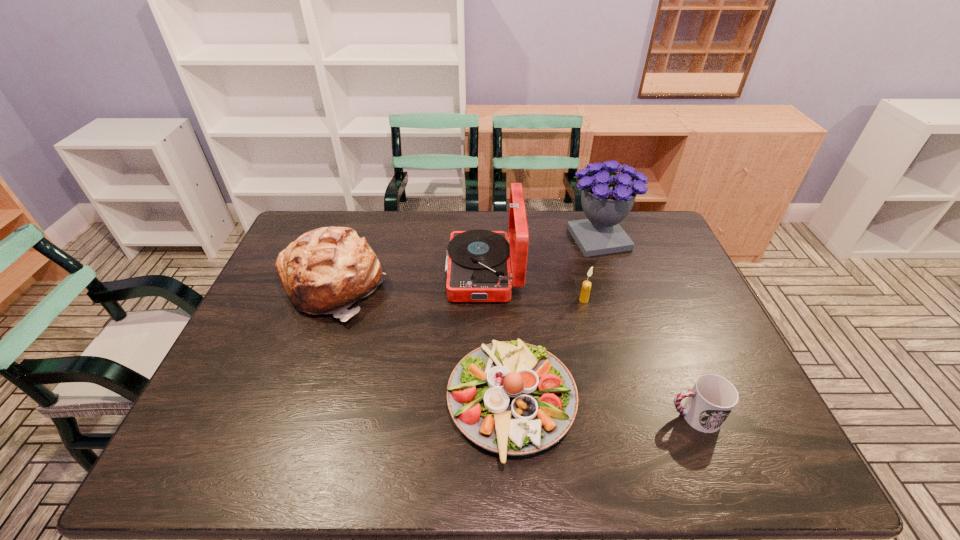
The image size is (960, 540). What are the coordinates of `bouquet` in the screenshot? It's located at (607, 198).

Locate an element on the screen. The width and height of the screenshot is (960, 540). phonograph_record is located at coordinates (478, 269).

Locate an element on the screen. This screenshot has height=540, width=960. the leftmost object is located at coordinates (x=326, y=270).

Where is `bread`? Image resolution: width=960 pixels, height=540 pixels. bread is located at coordinates (326, 270).

At what (x,y) coordinates should I click in order to perform the action: click on the third shortest object. Please return your answer as a coordinate pair (x, y). Looking at the image, I should click on (586, 286).

Find the location of a particular element. The width and height of the screenshot is (960, 540). cup is located at coordinates (711, 400).

At what (x,y) coordinates should I click in order to perform the action: click on salad plate. Please return your answer as a coordinate pair (x, y). Looking at the image, I should click on (512, 398).

Identify the location of free point located on the left of the bouquet. (494, 239).

Find the location of a particular element. The width and height of the screenshot is (960, 540). vacant space located 0.330m on the front-facing side of the phonograph_record is located at coordinates (342, 273).

Find the location of a particular element. This screenshot has height=540, width=960. free space located on the front-facing side of the phonograph_record is located at coordinates (339, 273).